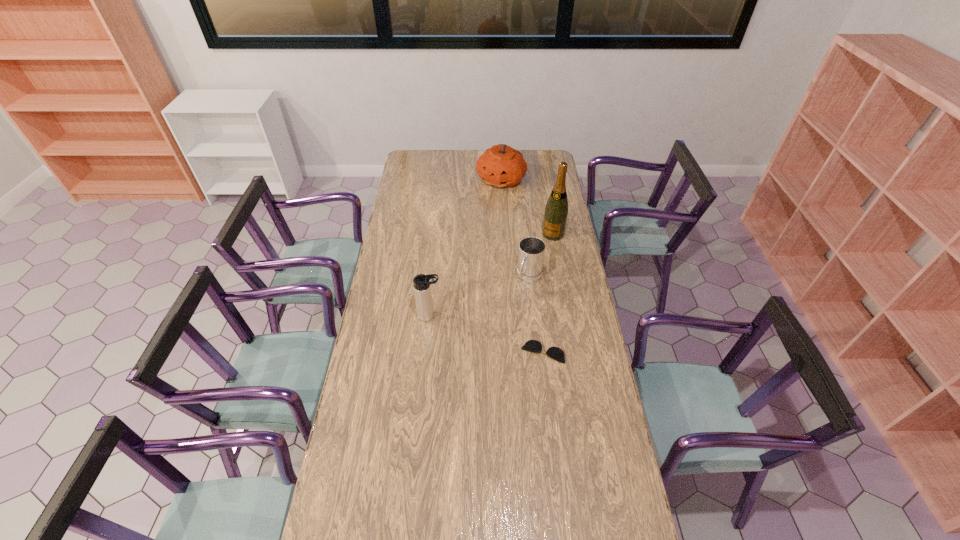
Identify the location of vacant region located on the left of the shortest object. (466, 352).

Where is `vacant space located on the front-facing side of the fourth nearest object`? The height and width of the screenshot is (540, 960). vacant space located on the front-facing side of the fourth nearest object is located at coordinates (527, 276).

What are the coordinates of `vacant space located 0.110m on the front-facing side of the fourth nearest object` in the screenshot? It's located at (540, 254).

At what (x,y) coordinates should I click in order to perform the action: click on vacant space situated on the front-facing side of the fourth nearest object. Please return your answer as a coordinate pair (x, y). The height and width of the screenshot is (540, 960). Looking at the image, I should click on (532, 268).

Locate an element on the screen. free space located on the side of the fourth tallest object with the handle is located at coordinates coord(497,328).

Find the location of `vacant space located on the side of the fourth tallest object with the handle`. vacant space located on the side of the fourth tallest object with the handle is located at coordinates (511, 307).

The width and height of the screenshot is (960, 540). Identify the location of free region located on the side of the fourth tallest object with the handle. (493, 334).

Find the location of `free point located 0.340m on the front-facing side of the farthest object`. free point located 0.340m on the front-facing side of the farthest object is located at coordinates (492, 233).

You are a GUI agent. You are given a task and a screenshot of the screen. Output one action in this format:
    pyautogui.click(x=<x>, y=<y>)
    Task: Click on the vacant area situated on the front-facing side of the farthest object
    The image size is (960, 540).
    Given the screenshot: What is the action you would take?
    pyautogui.click(x=492, y=235)

This screenshot has width=960, height=540. I want to click on vacant space located on the front-facing side of the farthest object, so click(x=492, y=241).